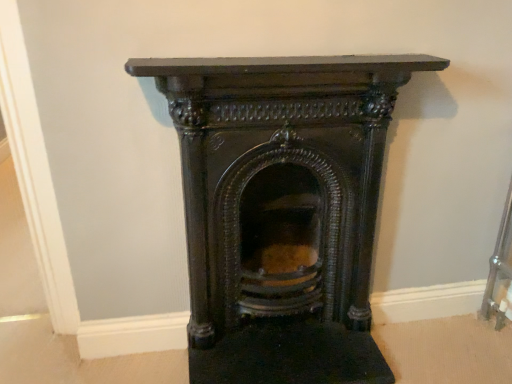
Describe the element at coordinates (282, 210) in the screenshot. This screenshot has width=512, height=384. I see `black cast iron fireplace at center` at that location.

Image resolution: width=512 pixels, height=384 pixels. I want to click on black cast iron fireplace at center, so click(282, 210).

This screenshot has height=384, width=512. Identify the location of black cast iron fireplace at center. coord(282,210).